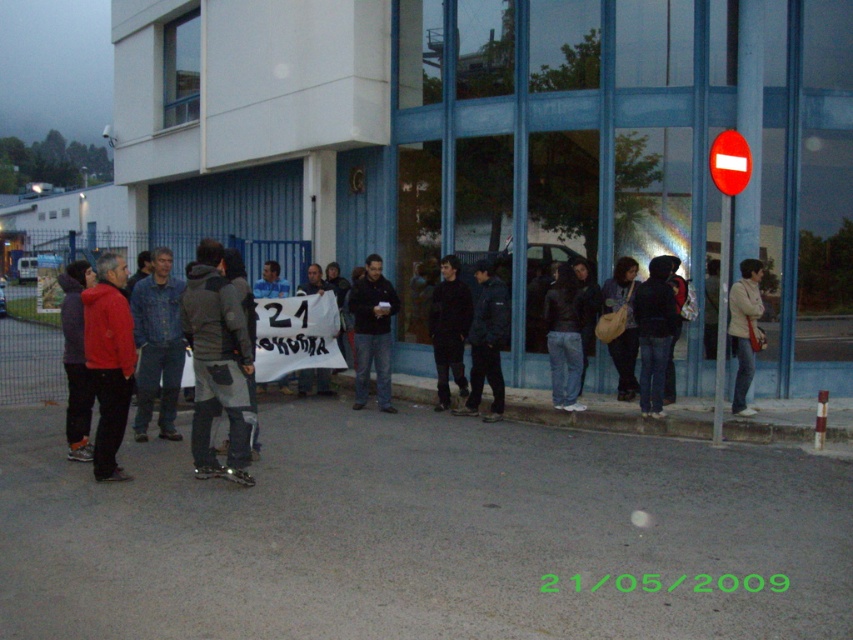
Is black matte jacket at center positioned in front of light beige jacket at center?

That is False.

Who is taller, black matte jacket at center or light beige jacket at center?

black matte jacket at center is taller.

Is point (397, 308) closer to viewer compared to point (741, 324)?

No, it is not.

This screenshot has width=853, height=640. I want to click on black matte jacket at center, so click(x=372, y=332).

Can you confirm if matte red jacket at left is positioned below light beige jacket at center?

Yes, matte red jacket at left is below light beige jacket at center.

Does point (120, 364) lie in front of point (749, 374)?

Yes, it is in front of point (749, 374).

The width and height of the screenshot is (853, 640). Find the location of `matte red jacket at left`. matte red jacket at left is located at coordinates (109, 360).

Based on the photo, which is below, matte red jacket at left or black matte jacket at center?

matte red jacket at left is below.

In the scene shown: Who is positioned more to the right, matte red jacket at left or black matte jacket at center?

black matte jacket at center

You are a GUI agent. You are given a task and a screenshot of the screen. Output one action in this format:
    pyautogui.click(x=<x>, y=<y>)
    Task: Click on the matte red jacket at left
    
    Given the screenshot: What is the action you would take?
    pyautogui.click(x=109, y=360)